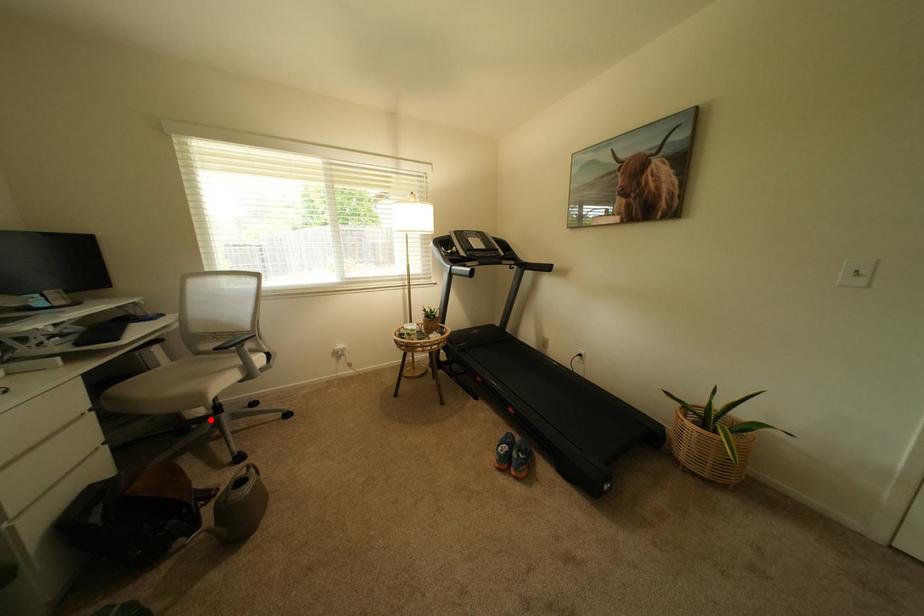
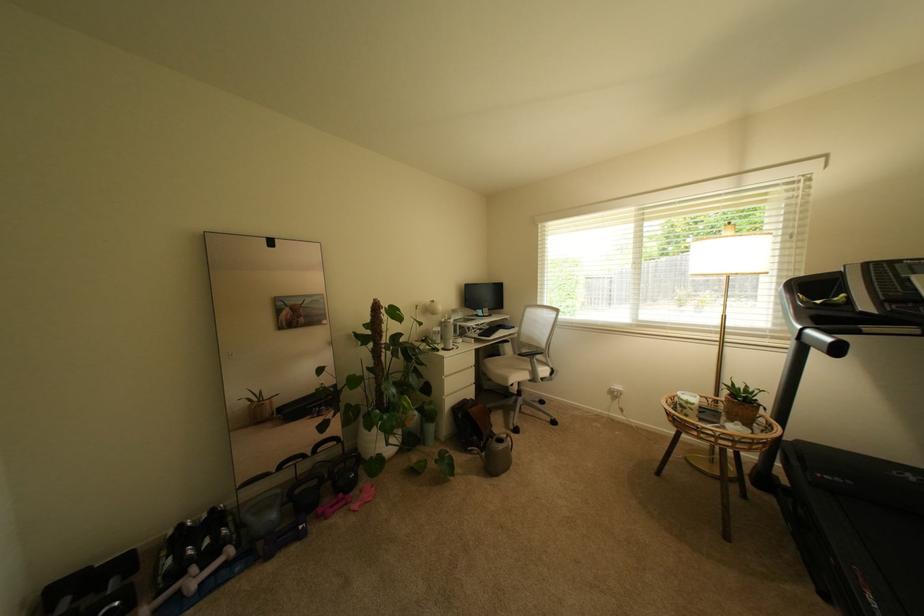
Question: I am providing you with two images of the same scene from different viewpoints. Given a red point in image1, look at the same physical point in image2. Is it:

Choices:
 (A) Closer to the viewpoint
 (B) Farther from the viewpoint

Answer: (B)